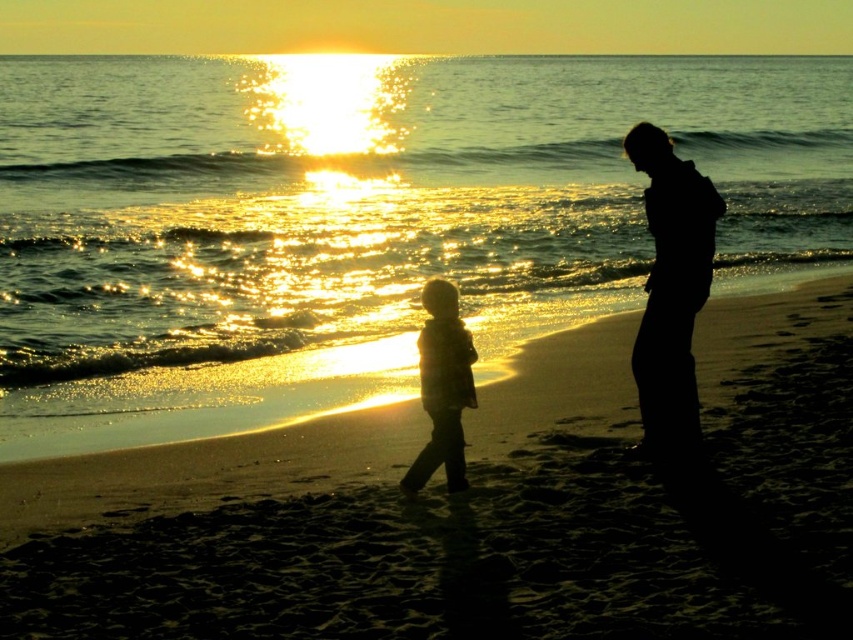
Question: Is shiny golden water at center bigger than sandy beach at center?

Choices:
 (A) no
 (B) yes

Answer: (B)

Question: Among these objects, which one is nearest to the camera?

Choices:
 (A) silhouette child at center
 (B) sandy beach at center
 (C) shiny golden water at center

Answer: (B)

Question: Among these points, which one is farthest from the camera?

Choices:
 (A) [x=614, y=145]
 (B) [x=422, y=346]

Answer: (A)

Question: Is shiny golden water at center further to the viewer compared to silhouette child at center?

Choices:
 (A) yes
 (B) no

Answer: (A)

Question: Is silhouette clothing at right further to the viewer compared to silhouette child at center?

Choices:
 (A) yes
 (B) no

Answer: (A)

Question: Which of these objects is positioned farthest from the shiny golden water at center?

Choices:
 (A) sandy beach at center
 (B) silhouette clothing at right

Answer: (B)